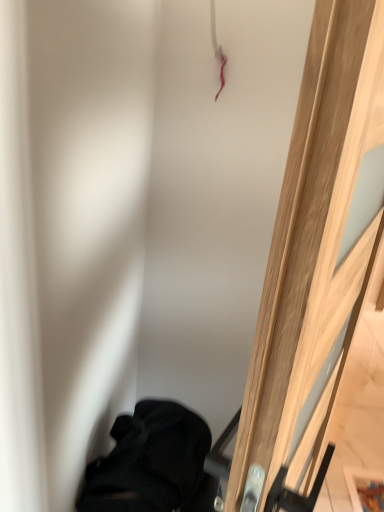
Locate an element on the screen. wooden door at right is located at coordinates (314, 260).

Describe the element at coordinates (314, 260) in the screenshot. Image resolution: width=384 pixels, height=512 pixels. I see `wooden door at right` at that location.

The image size is (384, 512). What do you see at coordinates (153, 463) in the screenshot?
I see `black fabric at lower left` at bounding box center [153, 463].

Identify the location of black fabric at lower left. The height and width of the screenshot is (512, 384). (153, 463).

Identify the location of wooden door at right. Image resolution: width=384 pixels, height=512 pixels. (314, 260).

In the scene shown: Which is more to the right, wooden door at right or black fabric at lower left?

From the viewer's perspective, wooden door at right appears more on the right side.

Is wooden door at right in front of or behind black fabric at lower left in the image?

Clearly, wooden door at right is in front of black fabric at lower left.

Between point (291, 387) and point (161, 459), which one is positioned behind?

Point (161, 459)

From the image's perspective, between wooden door at right and black fabric at lower left, who is located below?

black fabric at lower left.

From a real-world perspective, is wooden door at right physically located above or below black fabric at lower left?

From a real-world perspective, wooden door at right is physically above black fabric at lower left.

Which object is thinner, wooden door at right or black fabric at lower left?

wooden door at right is thinner.

Does wooden door at right have a lesser height compared to black fabric at lower left?

No.

Can you confirm if wooden door at right is bigger than black fabric at lower left?

Yes, wooden door at right is bigger than black fabric at lower left.

Would you say wooden door at right contains black fabric at lower left?

That's incorrect, black fabric at lower left is not inside wooden door at right.

Is wooden door at right touching black fabric at lower left?

wooden door at right is not next to black fabric at lower left, and they're not touching.

Is wooden door at right turned away from black fabric at lower left?

Yes, wooden door at right's orientation is away from black fabric at lower left.

Consider the image. How many degrees apart are the facing directions of wooden door at right and black fabric at lower left?

They differ by 23.7 degrees in their facing directions.

Measure the distance from wooden door at right to black fabric at lower left.

wooden door at right and black fabric at lower left are 13.02 inches apart from each other.

What are the coordinates of `door located on the right of black fabric at lower left` in the screenshot? It's located at (314, 260).

Which is more to the left, black fabric at lower left or wooden door at right?

black fabric at lower left.

Considering their positions, is black fabric at lower left located in front of or behind wooden door at right?

In the image, black fabric at lower left appears behind wooden door at right.

Is point (172, 506) positioned behind point (279, 413)?

That is True.

From the image's perspective, who appears lower, black fabric at lower left or wooden door at right?

black fabric at lower left.

From a real-world perspective, which is physically above, black fabric at lower left or wooden door at right?

wooden door at right.

Between black fabric at lower left and wooden door at right, which one has larger width?

black fabric at lower left.

Between black fabric at lower left and wooden door at right, which one has less height?

Standing shorter between the two is black fabric at lower left.

Who is smaller, black fabric at lower left or wooden door at right?

black fabric at lower left.

Looking at this image, is black fabric at lower left spatially inside wooden door at right, or outside of it?

black fabric at lower left lies outside wooden door at right.

Is there a large distance between black fabric at lower left and wooden door at right?

No, there isn't a large distance between black fabric at lower left and wooden door at right.

Is black fabric at lower left oriented away from wooden door at right?

No, black fabric at lower left is not facing away from wooden door at right.

How many degrees apart are the facing directions of black fabric at lower left and wooden door at right?

The angle between the facing direction of black fabric at lower left and the facing direction of wooden door at right is 23.7 degrees.

Locate an element on the screen. The height and width of the screenshot is (512, 384). furniture that appears on the left of wooden door at right is located at coordinates (153, 463).

Image resolution: width=384 pixels, height=512 pixels. Identify the location of furniture behind the wooden door at right. (153, 463).

You are a GUI agent. You are given a task and a screenshot of the screen. Output one action in this format:
    pyautogui.click(x=<x>, y=<y>)
    Task: Click on the door that is above the black fabric at lower left (from a real-world perspective)
    This screenshot has height=512, width=384.
    Given the screenshot: What is the action you would take?
    pyautogui.click(x=314, y=260)